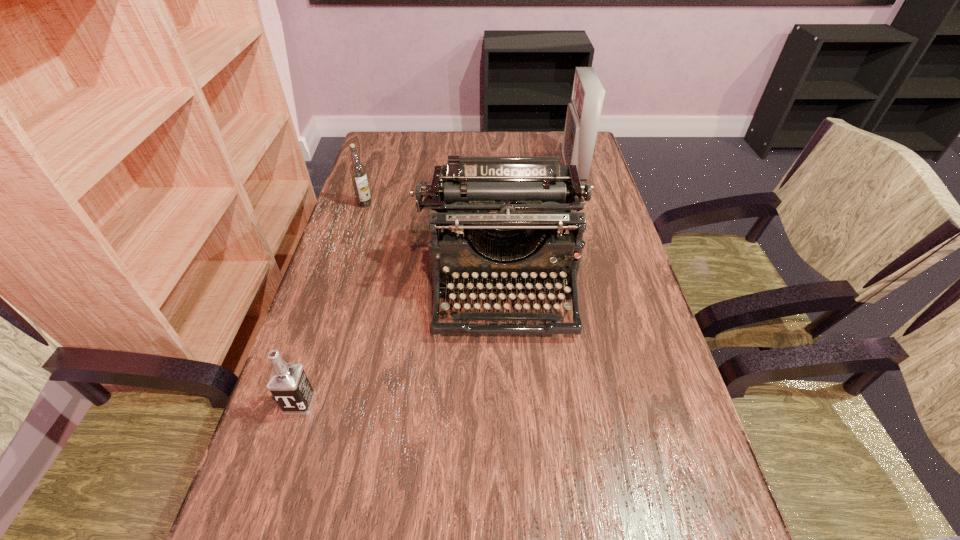
Find the location of `free space located on the front-facing side of the rightmost object`. free space located on the front-facing side of the rightmost object is located at coordinates (537, 167).

Image resolution: width=960 pixels, height=540 pixels. I want to click on vacant region located on the typing side of the third farthest object, so click(x=510, y=437).

What are the coordinates of `vacant space located on the label of the second shortest object` in the screenshot? It's located at (337, 293).

Find the location of `vacant space located 0.180m on the front label of the shortest object`. vacant space located 0.180m on the front label of the shortest object is located at coordinates (263, 521).

The height and width of the screenshot is (540, 960). I want to click on object located at the far edge, so click(583, 113).

Image resolution: width=960 pixels, height=540 pixels. Identify the location of the first-aid kit present at the right edge. (583, 113).

In order to click on typewriter situated at the right edge in this screenshot , I will do `click(513, 208)`.

Where is `object present at the far right corner`? This screenshot has width=960, height=540. object present at the far right corner is located at coordinates (583, 113).

Find the location of a particular element. blank space at the far edge of the desktop is located at coordinates (514, 148).

Image resolution: width=960 pixels, height=540 pixels. In order to click on free space at the left edge of the desktop in this screenshot , I will do `click(358, 342)`.